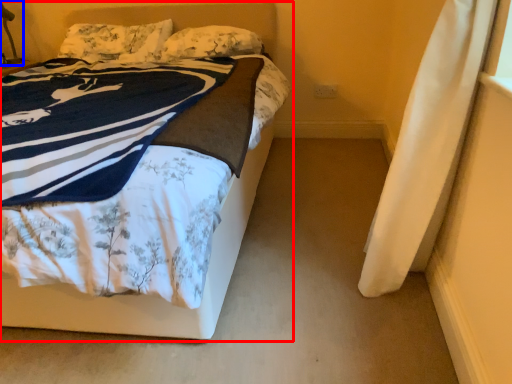
Question: Which point is closer to the camera, bed (highlighted by a red box) or table lamp (highlighted by a blue box)?

Choices:
 (A) bed
 (B) table lamp

Answer: (A)